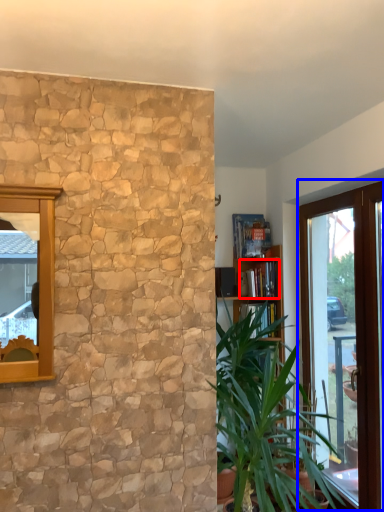
Question: Which of the following is the closest to the observer, book (highlighted by a red box) or window (highlighted by a blue box)?

Choices:
 (A) book
 (B) window

Answer: (B)